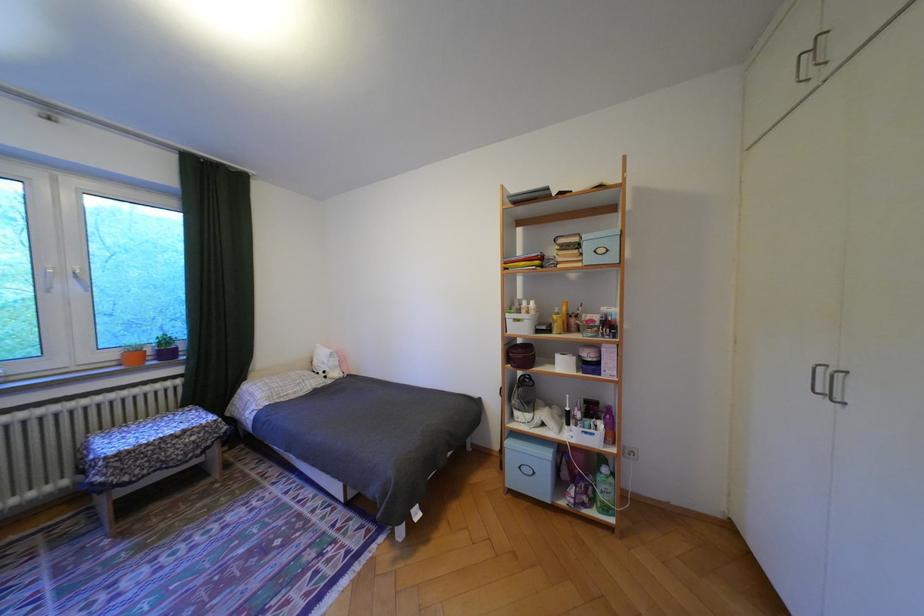
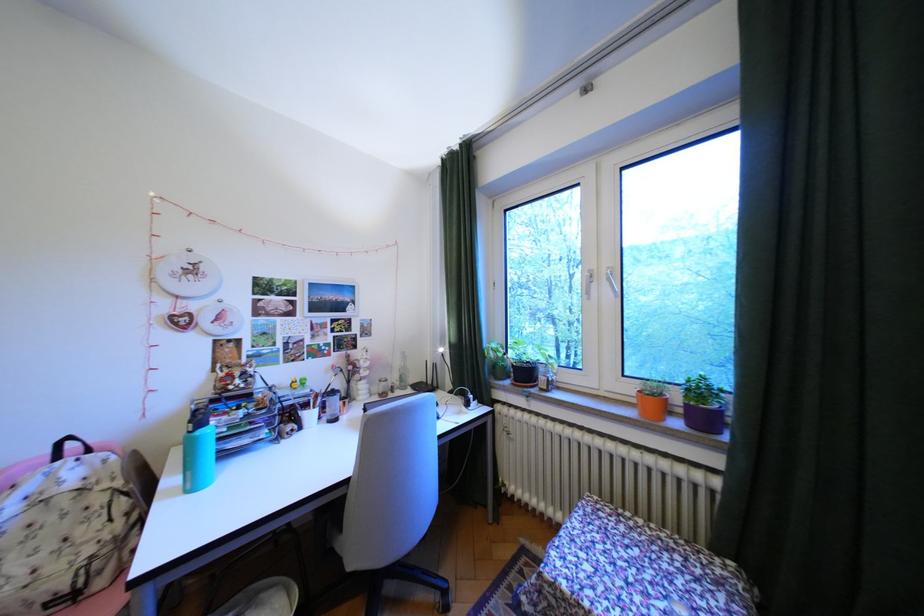
The point at (176, 341) is marked in the first image. Where is the corresponding point in the second image?

(710, 391)